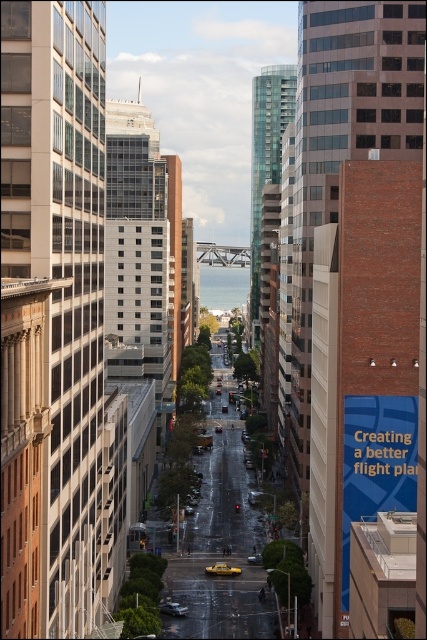
You are a pedestrian standing at the edge of the street. You see a yellow rubber taxi at center and a metallic silver sedan at center. Which vehicle is closer to you?

The yellow rubber taxi at center is closer to you because it is further to the viewer than the metallic silver sedan at center.

You are a delivery person who needs to park your vehicle in a tight space. You have a yellow rubber taxi at center and a metallic silver sedan at center in front of you. Which vehicle should you choose to fit into the space more easily?

The yellow rubber taxi at center has a smaller size compared to the metallic silver sedan at center, so it would be easier to fit into the tight space.

You are a delivery drone flying over an urban area. You need to land precisely on the yellow rubber taxi at center. What are the coordinates where you should aim your landing?

The coordinates for the yellow rubber taxi at center are at point (222,570).